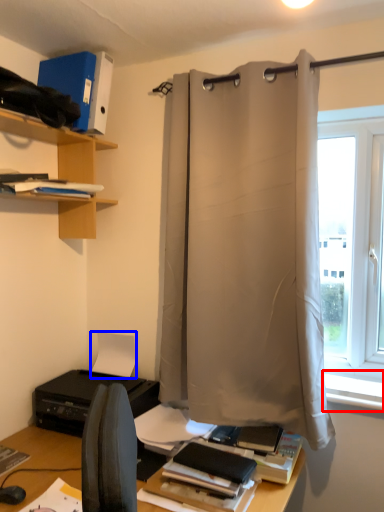
Question: Which point is closer to the camera, window sill (highlighted by a red box) or paper (highlighted by a blue box)?

Choices:
 (A) window sill
 (B) paper

Answer: (A)